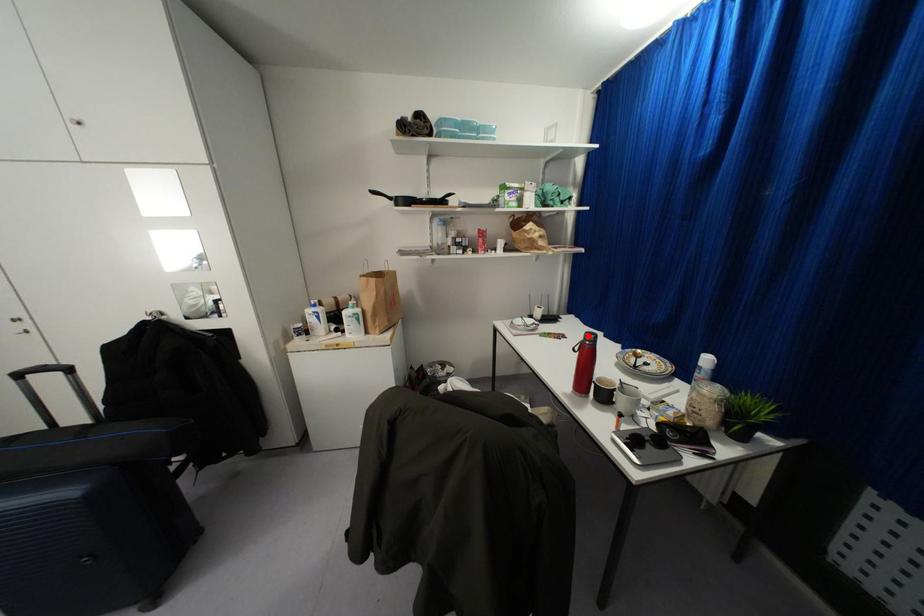
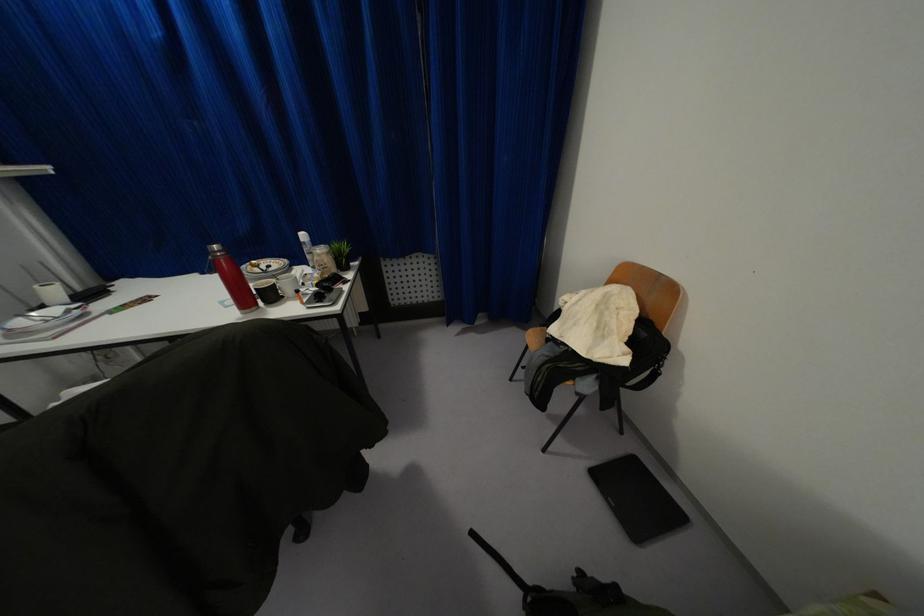
Question: I am providing you with two images of the same scene from different viewpoints. A red point is marked on the first image. At the location where the point appears in image 1, is it still visible in image 2?

Choices:
 (A) Yes
 (B) No

Answer: (A)